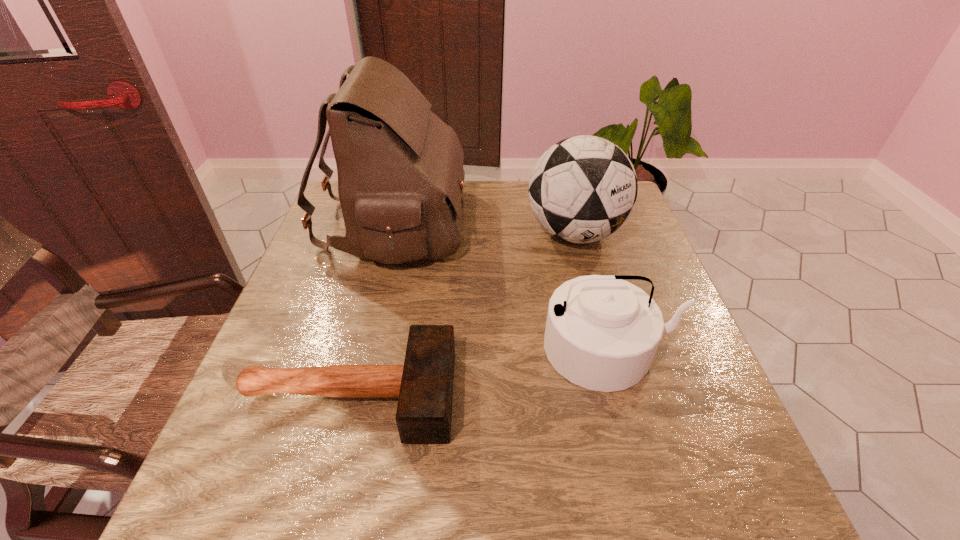
Locate an element on the screen. This screenshot has height=540, width=960. the tallest object is located at coordinates (400, 170).

Locate an element on the screen. the second tallest object is located at coordinates (582, 189).

You are a GUI agent. You are given a task and a screenshot of the screen. Output one action in this format:
    pyautogui.click(x=<x>, y=<y>)
    Task: Click on the kettle
    
    Given the screenshot: What is the action you would take?
    pyautogui.click(x=602, y=333)

The height and width of the screenshot is (540, 960). I want to click on mallet, so click(424, 384).

This screenshot has width=960, height=540. I want to click on vacant space positioned 0.320m on the front flap of the satchel, so click(577, 224).

You are a GUI agent. You are given a task and a screenshot of the screen. Output one action in this format:
    pyautogui.click(x=<x>, y=<y>)
    Task: Click on the vacant position located 0.330m on the surface of the third shortest object where the brand logo is visible
    Image resolution: width=960 pixels, height=540 pixels.
    Given the screenshot: What is the action you would take?
    pyautogui.click(x=611, y=371)

Locate an element on the screen. The height and width of the screenshot is (540, 960). vacant space situated 0.110m on the spout of the second shortest object is located at coordinates (636, 448).

The width and height of the screenshot is (960, 540). Find the location of `vacant position located on the hammer head face of the shortest object`. vacant position located on the hammer head face of the shortest object is located at coordinates (510, 394).

Where is `satchel situated at the far edge`? Image resolution: width=960 pixels, height=540 pixels. satchel situated at the far edge is located at coordinates [x=400, y=170].

Locate an element on the screen. soccer ball present at the far edge is located at coordinates (582, 189).